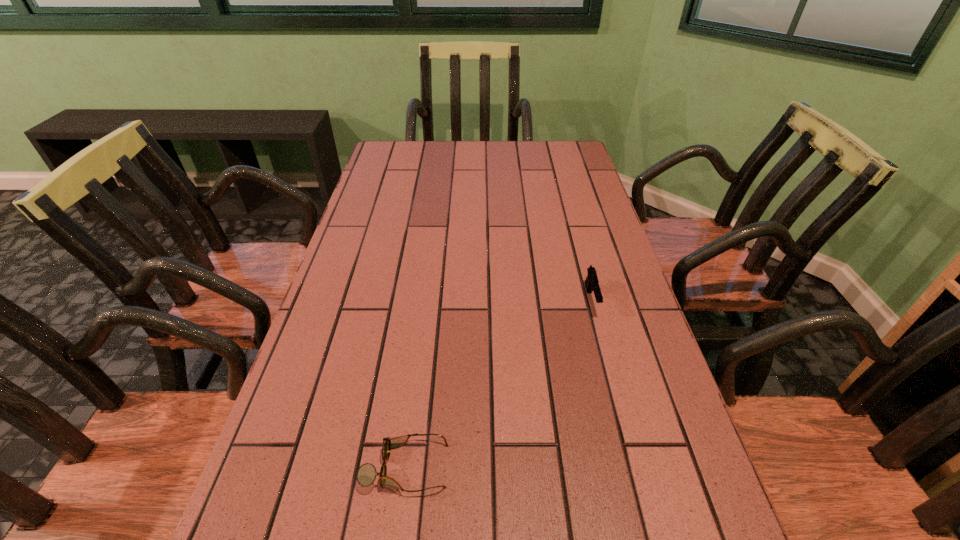
Find the location of `pistol`. pistol is located at coordinates [x=591, y=283].

Find the location of a particular element. The image size is (960, 540). the right object is located at coordinates (591, 283).

Identify the location of spectacles. (366, 474).

Where is `the nearer object`? the nearer object is located at coordinates (366, 474).

Image resolution: width=960 pixels, height=540 pixels. Identify the location of vacant space located on the front-facing side of the farther object. (623, 420).

Locate an element on the screen. The height and width of the screenshot is (540, 960). blank space located on the front-facing side of the shorter object is located at coordinates (585, 467).

You are a GUI agent. You are given a task and a screenshot of the screen. Output one action in this format:
    pyautogui.click(x=<x>, y=<y>)
    Task: Click on the object located in the right edge section of the desktop
    
    Given the screenshot: What is the action you would take?
    pyautogui.click(x=591, y=283)

Locate an element on the screen. free space at the far edge of the desktop is located at coordinates (441, 148).

Locate an element on the screen. This screenshot has width=960, height=540. vacant space at the left edge of the desktop is located at coordinates (392, 248).

This screenshot has height=540, width=960. In the image, there is a desktop. Find the location of `vacant region at the right edge`. vacant region at the right edge is located at coordinates (565, 179).